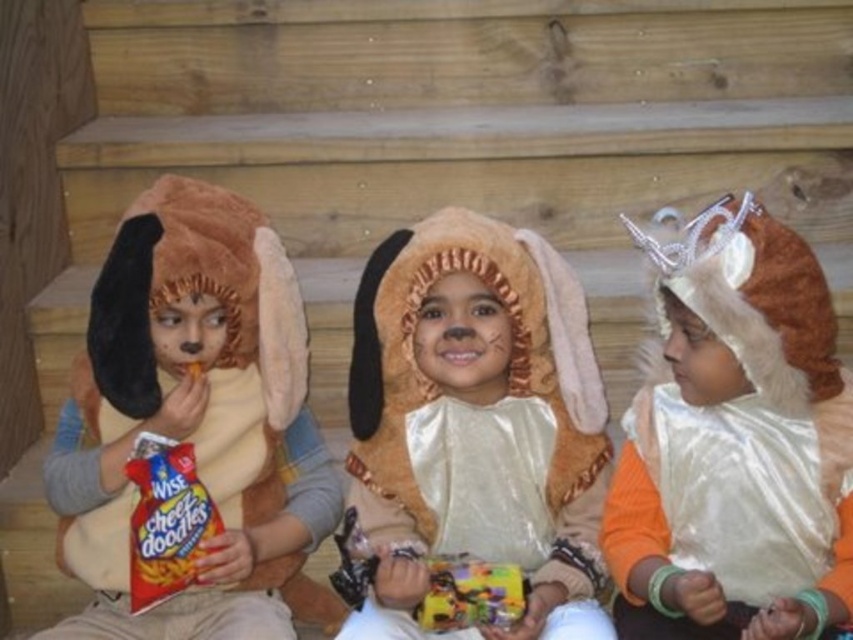
You are a photographer trying to capture a clear shot of the fuzzy beige costume at center and the white shiny cape at center. Which object is blocking the view of the other?

The fuzzy beige costume at center is blocking the view of the white shiny cape at center because the cape is positioned behind the costume.

You are a photographer trying to capture a clear photo of the fuzzy tan costume at center and the matte brown plush dog at left. Since you want both subjects to be in focus, which one should you focus on first to ensure the other is also in focus?

You should focus on the matte brown plush dog at left first because the fuzzy tan costume at center is in front of it, so adjusting focus for the closer object will help both be in focus.

You are a photographer trying to capture a closeup shot of the candy held by the child in the lion costume. You are currently positioned at point (409, 532). There is an obstacle at point (724, 556). Which direction should you move to avoid the obstacle while getting closer to the candy?

Since point (409, 532) is closer to you than point (724, 556), you should move towards the obstacle at (724, 556) to get closer to the candy while navigating around it.